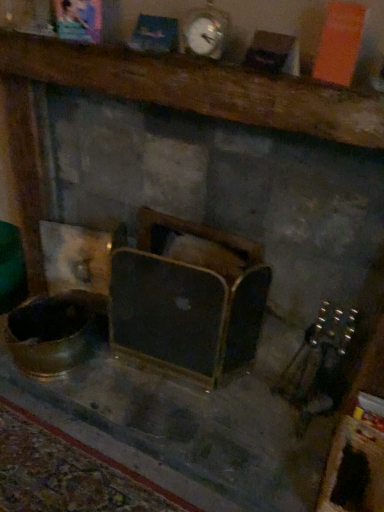
Identify the location of free space in front of wooden framed mirror at center, which is counted as the 2th furniture, starting from the top. (172, 408).